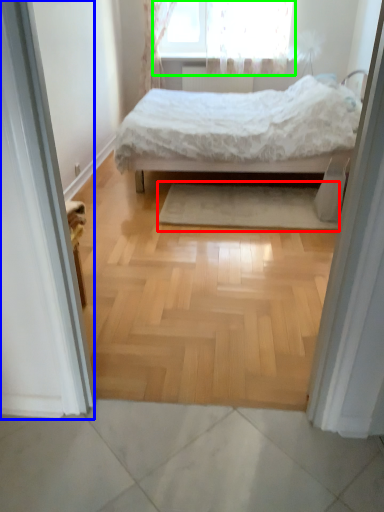
Question: Based on their relative distances, which object is nearer to mat (highlighted by a red box)? Choose from screen door (highlighted by a blue box) and window (highlighted by a green box).

Choices:
 (A) screen door
 (B) window

Answer: (A)